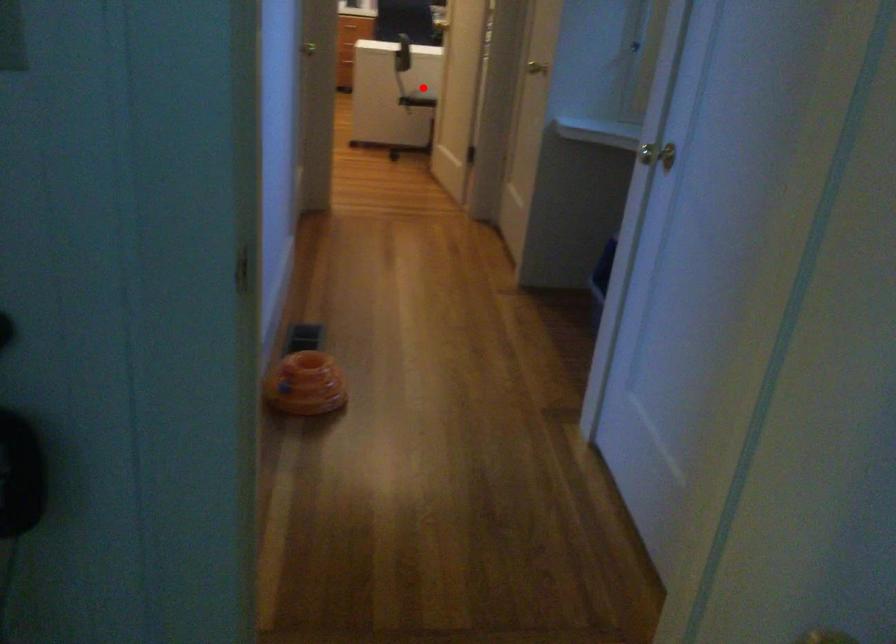
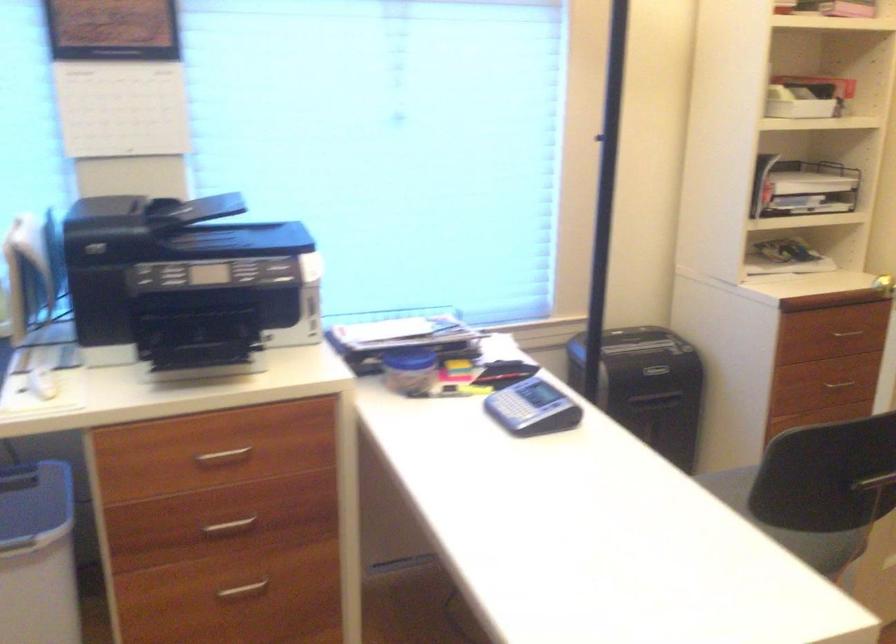
Find the pixel in the second image that matches the highlighted location in the first image.

(788, 525)